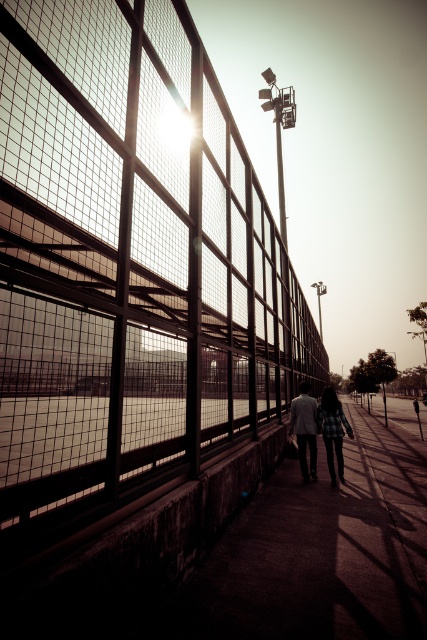
What do you see at coordinates (129, 262) in the screenshot? I see `metal mesh fence at center` at bounding box center [129, 262].

Between metal mesh fence at center and matte gray suit at center, which one appears on the left side from the viewer's perspective?

matte gray suit at center is more to the left.

What are the coordinates of `metal mesh fence at center` in the screenshot? It's located at (129, 262).

This screenshot has height=640, width=427. I want to click on metal mesh fence at center, so click(x=129, y=262).

Is plaid fabric couple at center positioned before matte gray suit at center?

Yes.

Which is behind, point (292, 412) or point (289, 435)?

The point (289, 435) is more distant.

Is point (324, 410) positioned after point (295, 408)?

No, (324, 410) is closer to viewer.

Locate an element on the screen. plaid fabric couple at center is located at coordinates (332, 429).

Between metal mesh fence at center and plaid fabric couple at center, which one appears on the right side from the viewer's perspective?

metal mesh fence at center is more to the right.

Which is behind, point (137, 241) or point (333, 440)?

Positioned behind is point (333, 440).

Locate an element on the screen. This screenshot has width=427, height=640. metal mesh fence at center is located at coordinates (129, 262).